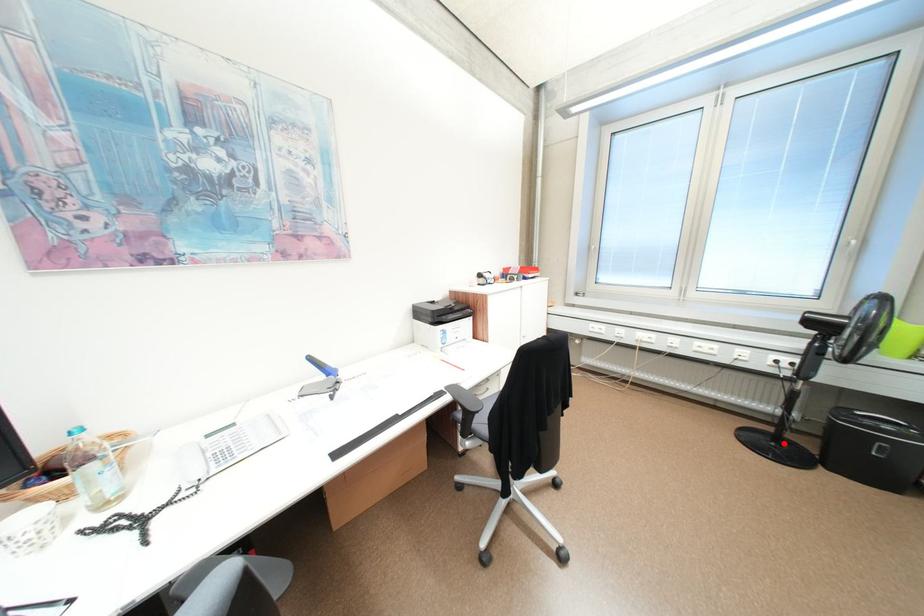
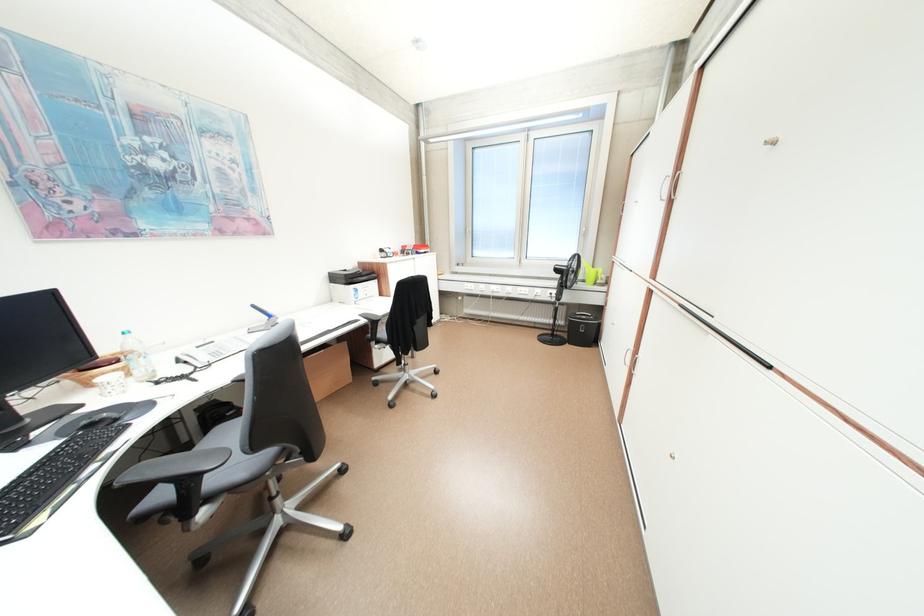
Where in the second image is the point corresponding to the highlighted location from the first image?

(561, 338)